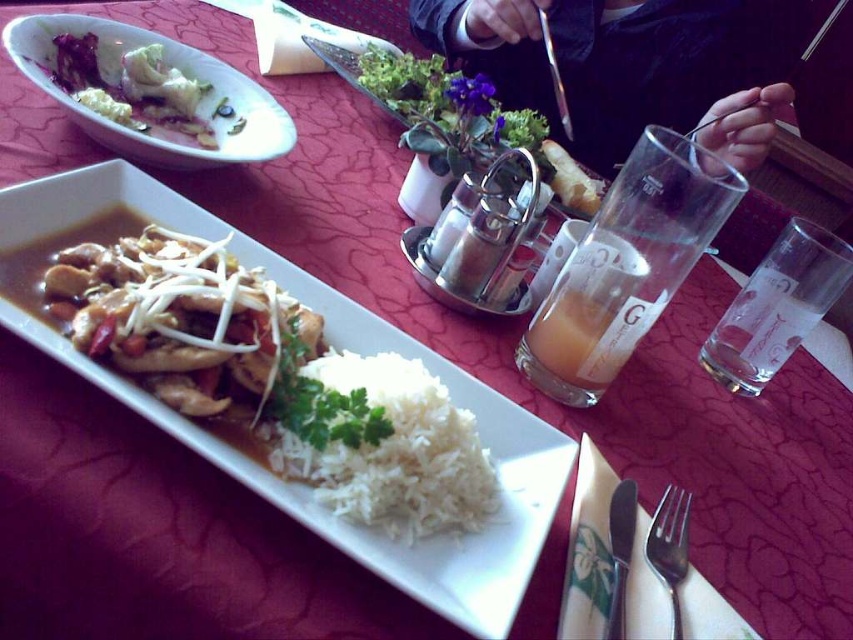
Does dark suit jacket at upper center have a smaller size compared to satin silver fork at lower right?

Incorrect, dark suit jacket at upper center is not smaller in size than satin silver fork at lower right.

Does dark suit jacket at upper center have a greater width compared to satin silver fork at lower right?

Yes, dark suit jacket at upper center is wider than satin silver fork at lower right.

Who is more distant from viewer, (802, 42) or (666, 488)?

The point (802, 42) is behind.

Locate an element on the screen. This screenshot has width=853, height=640. dark suit jacket at upper center is located at coordinates (630, 65).

Between white glossy rice at center and satin silver fork at lower right, which one has more height?

white glossy rice at center is taller.

Describe the element at coordinates (276, 380) in the screenshot. I see `white glossy rice at center` at that location.

You are a GUI agent. You are given a task and a screenshot of the screen. Output one action in this format:
    pyautogui.click(x=<x>, y=<y>)
    Task: Click on the white glossy rice at center
    Image resolution: width=853 pixels, height=640 pixels.
    Given the screenshot: What is the action you would take?
    pyautogui.click(x=276, y=380)

Is point (131, 291) positioned in front of point (584, 259)?

Yes, it is in front of point (584, 259).

Who is shorter, white glossy rice at center or translucent glass at right?

translucent glass at right

Is point (315, 349) behind point (567, 323)?

No, (315, 349) is closer to viewer.

In order to click on white glossy rice at center in this screenshot , I will do `click(276, 380)`.